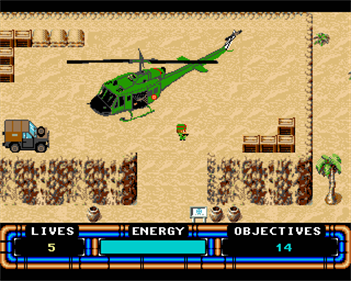
In order to click on boxes in this screenshot , I will do `click(251, 144)`, `click(269, 147)`, `click(290, 149)`, `click(288, 129)`.